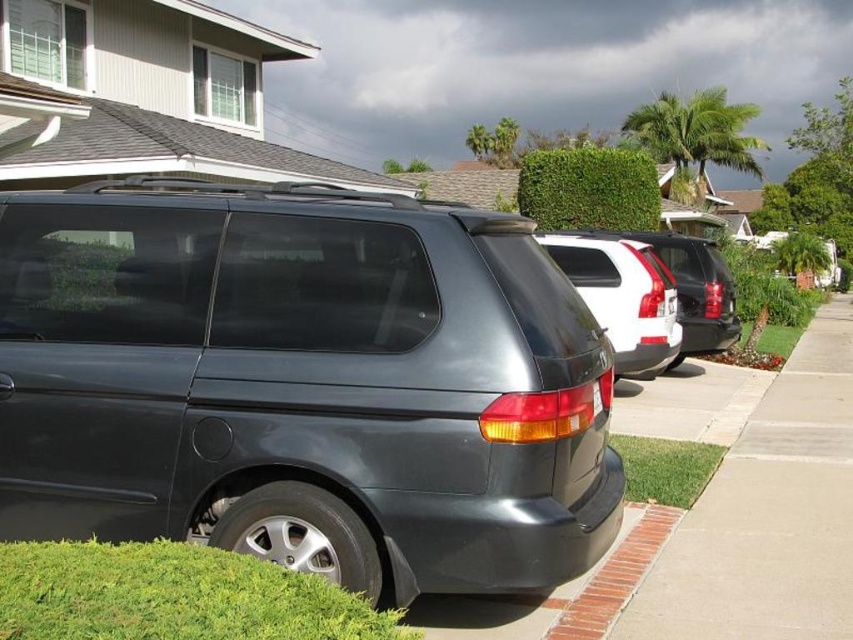
Describe the element at coordinates (303, 384) in the screenshot. The height and width of the screenshot is (640, 853). I see `satin dark gray minivan at center` at that location.

How much distance is there between satin dark gray minivan at center and brick at lower right?

satin dark gray minivan at center and brick at lower right are 1.57 meters apart from each other.

Who is more forward, (368, 536) or (637, 570)?

Positioned in front is point (368, 536).

This screenshot has height=640, width=853. I want to click on satin dark gray minivan at center, so click(x=303, y=384).

Who is positioned more to the right, white matte suv at center or brick at lower right?

white matte suv at center

Can you confirm if white matte suv at center is smaller than brick at lower right?

Actually, white matte suv at center might be larger than brick at lower right.

Between point (643, 358) and point (625, 540), which one is positioned behind?

Positioned behind is point (643, 358).

At what (x,y) coordinates should I click in order to perform the action: click on white matte suv at center. Please return your answer as a coordinate pair (x, y). This screenshot has width=853, height=640. Looking at the image, I should click on (624, 298).

Is concrete at center bigger than brick at lower right?

Correct, concrete at center is larger in size than brick at lower right.

Is point (759, 579) behind point (561, 616)?

Yes, it is.

I want to click on concrete at center, so click(x=769, y=515).